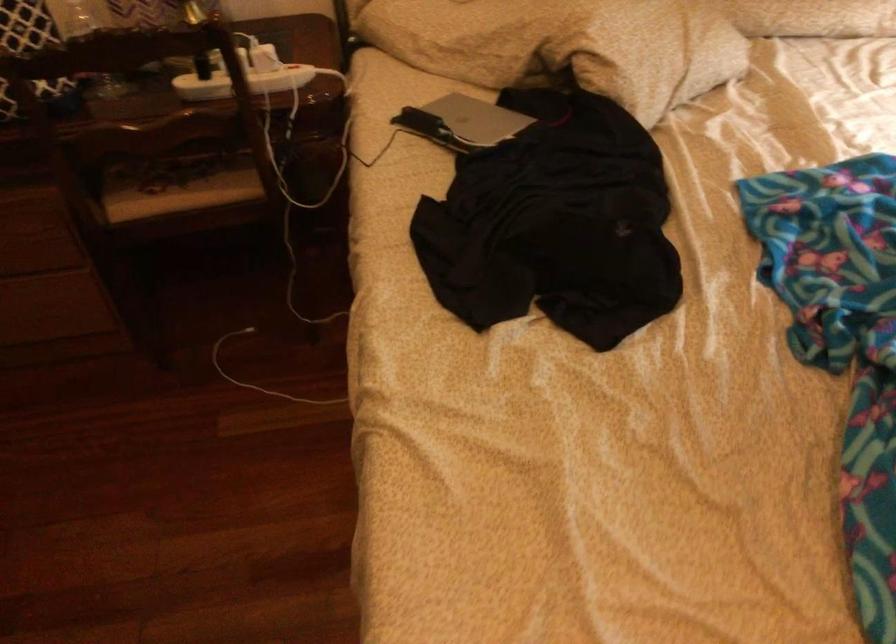
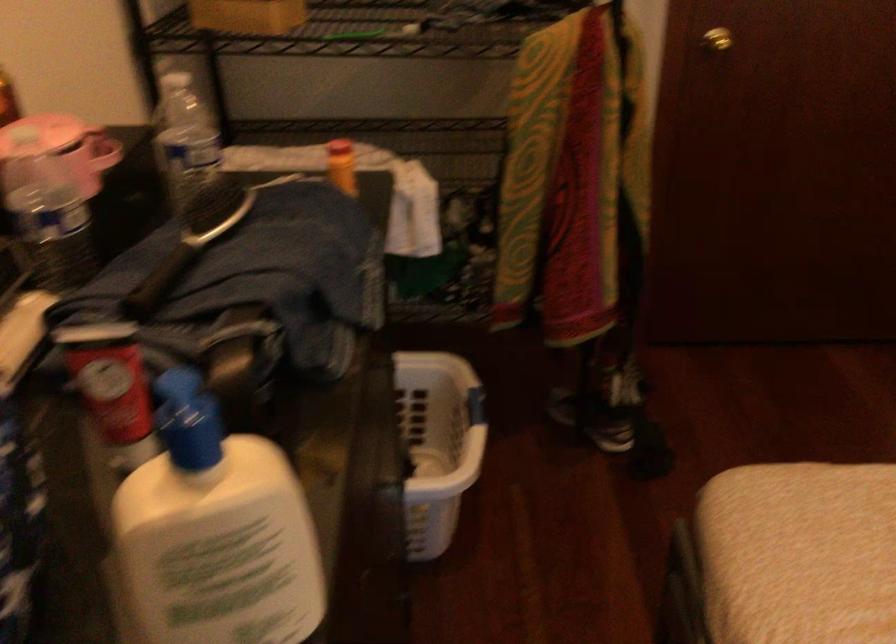
First-person continuous shooting, in which direction is the camera rotating?

The camera rotated toward left-down.